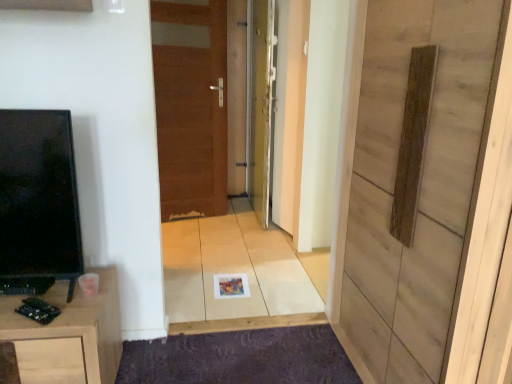
The image size is (512, 384). I want to click on vacant space underneath brown wooden door at center, placed as the third door when sorted from front to back (from a real-world perspective), so click(196, 213).